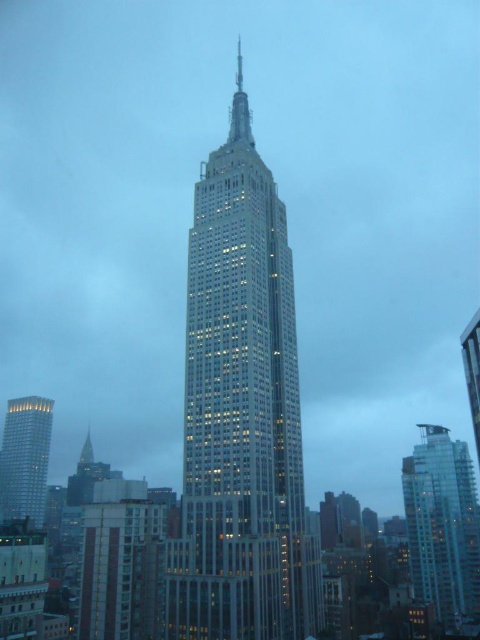
Question: Can you confirm if glassy steel skyscraper at center is bigger than silver glass tower at lower left?

Choices:
 (A) yes
 (B) no

Answer: (A)

Question: Is glassy steel skyscraper at center further to the viewer compared to glassy silver skyscraper at right?

Choices:
 (A) no
 (B) yes

Answer: (A)

Question: Which of the following is the closest to the observer?

Choices:
 (A) glassy steel skyscraper at center
 (B) glassy silver skyscraper at right
 (C) silver glass tower at lower left

Answer: (A)

Question: Which point is closer to the camera taking this photo?

Choices:
 (A) (11, 419)
 (B) (425, 435)
 (C) (313, 563)

Answer: (C)

Question: Which object is the farthest from the glassy steel skyscraper at center?

Choices:
 (A) glassy silver skyscraper at right
 (B) silver glass tower at lower left

Answer: (B)

Question: Does glassy steel skyscraper at center appear under silver glass tower at lower left?

Choices:
 (A) yes
 (B) no

Answer: (B)